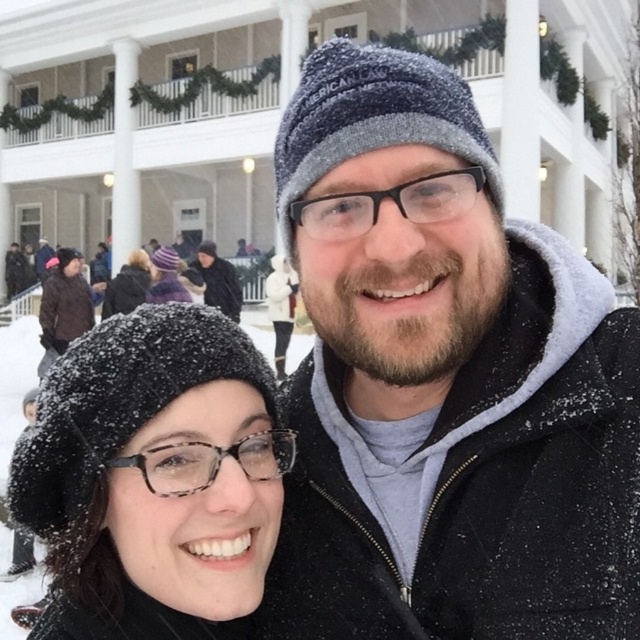
Question: Does knitted wool hat at center lie in front of black fuzzy hat at upper left?

Choices:
 (A) no
 (B) yes

Answer: (B)

Question: Does knitted wool hat at center have a greater width compared to dark gray knit hat at center?

Choices:
 (A) yes
 (B) no

Answer: (B)

Question: Considering the relative positions of black knitted beret at lower left and dark gray knit hat at center in the image provided, where is black knitted beret at lower left located with respect to dark gray knit hat at center?

Choices:
 (A) right
 (B) left

Answer: (A)

Question: Which is farther from the black fuzzy hat at upper left?

Choices:
 (A) black knitted beret at lower left
 (B) dark gray knit hat at center

Answer: (A)

Question: Based on their relative distances, which object is farther from the knitted wool hat at center?

Choices:
 (A) black knitted beret at lower left
 (B) black fuzzy hat at upper left
 (C) dark gray knit hat at center

Answer: (C)

Question: Which point appears farthest from the camera in this image?

Choices:
 (A) (390, 388)
 (B) (140, 524)
 (C) (237, 308)

Answer: (C)